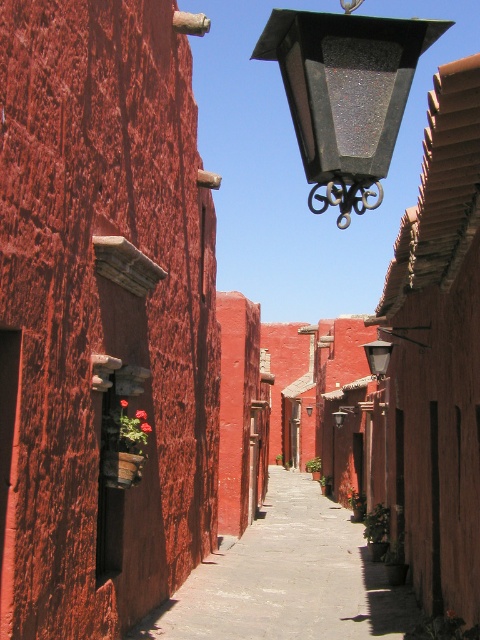
Question: Among these objects, which one is farthest from the camera?

Choices:
 (A) smooth concrete pavement at center
 (B) black textured lantern at upper center

Answer: (A)

Question: Which of the following is the farthest from the observer?

Choices:
 (A) (344, 124)
 (B) (299, 493)

Answer: (B)

Question: Where is smooth concrete pavement at center located in relation to black textured lantern at upper center in the image?

Choices:
 (A) above
 (B) below

Answer: (B)

Question: Is smooth concrete pavement at center to the left of black textured lantern at upper center from the viewer's perspective?

Choices:
 (A) yes
 (B) no

Answer: (A)

Question: Which of the following is the closest to the observer?

Choices:
 (A) (381, 116)
 (B) (271, 509)

Answer: (A)

Question: Is smooth concrete pavement at center smaller than black textured lantern at upper center?

Choices:
 (A) no
 (B) yes

Answer: (A)